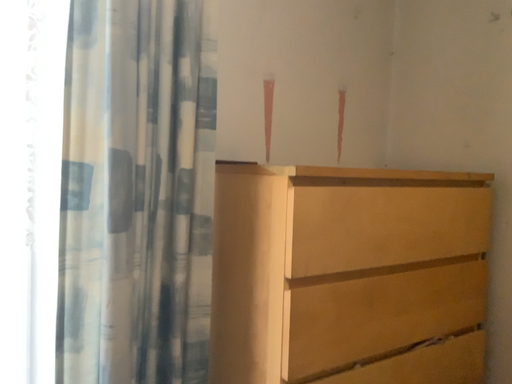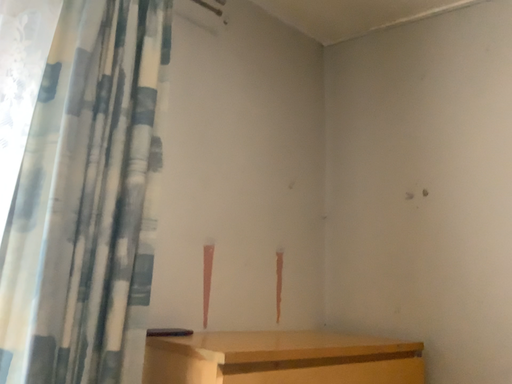
Question: Which way did the camera rotate in the video?

Choices:
 (A) rotated downward
 (B) rotated upward

Answer: (B)